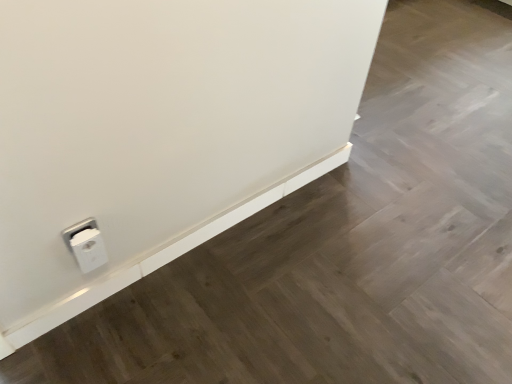
Measure the distance between point (88,256) and camera.

They are 3.60 feet apart.

Describe the element at coordinates (86, 244) in the screenshot. I see `white plastic power plug at lower left` at that location.

The height and width of the screenshot is (384, 512). What are the coordinates of `white plastic power plug at lower left` in the screenshot? It's located at (86, 244).

Measure the distance between point (275, 201) and camera.

The distance of point (275, 201) from camera is 1.59 meters.

What do you see at coordinates (164, 255) in the screenshot? The image size is (512, 384). I see `white plastic ledge at lower left` at bounding box center [164, 255].

Image resolution: width=512 pixels, height=384 pixels. What are the coordinates of `white plastic ledge at lower left` in the screenshot? It's located at (164, 255).

Identify the location of white plastic power plug at lower left. (86, 244).

In the image, is white plastic ledge at lower left on the left side or the right side of white plastic power plug at lower left?

Based on their positions, white plastic ledge at lower left is located to the right of white plastic power plug at lower left.

Does white plastic ledge at lower left lie in front of white plastic power plug at lower left?

No, it is behind white plastic power plug at lower left.

Does point (83, 301) appear closer or farther from the camera than point (76, 252)?

Point (83, 301) is positioned farther from the camera compared to point (76, 252).

From the image's perspective, relative to white plastic power plug at lower left, is white plastic ledge at lower left above or below?

Based on their image positions, white plastic ledge at lower left is located above white plastic power plug at lower left.

From a real-world perspective, is white plastic ledge at lower left below white plastic power plug at lower left?

Correct, in the physical world, white plastic ledge at lower left is lower than white plastic power plug at lower left.

Which of these two, white plastic ledge at lower left or white plastic power plug at lower left, is thinner?

white plastic ledge at lower left is thinner.

From their relative heights in the image, would you say white plastic ledge at lower left is taller or shorter than white plastic power plug at lower left?

In the image, white plastic ledge at lower left appears to be shorter than white plastic power plug at lower left.

Considering the relative sizes of white plastic ledge at lower left and white plastic power plug at lower left in the image provided, is white plastic ledge at lower left bigger than white plastic power plug at lower left?

Yes, white plastic ledge at lower left is bigger than white plastic power plug at lower left.

In the scene shown: Which is correct: white plastic ledge at lower left is inside white plastic power plug at lower left, or outside of it?

white plastic ledge at lower left is not enclosed by white plastic power plug at lower left.

Is white plastic ledge at lower left positioned far away from white plastic power plug at lower left?

No, there isn't a large distance between white plastic ledge at lower left and white plastic power plug at lower left.

Is white plastic ledge at lower left positioned with its back to white plastic power plug at lower left?

white plastic ledge at lower left is not turned away from white plastic power plug at lower left.

How many degrees apart are the facing directions of white plastic ledge at lower left and white plastic power plug at lower left?

0.499 degrees separate the facing orientations of white plastic ledge at lower left and white plastic power plug at lower left.

At what (x,y) coordinates should I click in order to perform the action: click on power plugs and sockets on the left of the white plastic ledge at lower left. Please return your answer as a coordinate pair (x, y). The height and width of the screenshot is (384, 512). Looking at the image, I should click on (86, 244).

Between white plastic power plug at lower left and white plastic ledge at lower left, which one appears on the right side from the viewer's perspective?

From the viewer's perspective, white plastic ledge at lower left appears more on the right side.

Does white plastic power plug at lower left lie behind white plastic ledge at lower left?

No.

Is point (68, 230) closer or farther from the camera than point (60, 320)?

Point (68, 230) is closer to the camera than point (60, 320).

From the image's perspective, is white plastic power plug at lower left above or below white plastic ledge at lower left?

Based on their image positions, white plastic power plug at lower left is located beneath white plastic ledge at lower left.

From a real-world perspective, does white plastic power plug at lower left stand above white plastic ledge at lower left?

Yes, from a real-world perspective, white plastic power plug at lower left is above white plastic ledge at lower left.

Looking at their sizes, would you say white plastic power plug at lower left is wider or thinner than white plastic ledge at lower left?

Considering their sizes, white plastic power plug at lower left looks broader than white plastic ledge at lower left.

In terms of height, does white plastic power plug at lower left look taller or shorter compared to white plastic ledge at lower left?

Clearly, white plastic power plug at lower left is taller compared to white plastic ledge at lower left.

Is white plastic power plug at lower left bigger than white plastic ledge at lower left?

Incorrect, white plastic power plug at lower left is not larger than white plastic ledge at lower left.

Could white plastic ledge at lower left be considered to be inside white plastic power plug at lower left?

No, white plastic ledge at lower left is not surrounded by white plastic power plug at lower left.

Would you say white plastic power plug at lower left is a long distance from white plastic ledge at lower left?

No, white plastic power plug at lower left is not far away from white plastic ledge at lower left.

Could you tell me if white plastic power plug at lower left is facing white plastic ledge at lower left?

No, white plastic power plug at lower left is not aimed at white plastic ledge at lower left.

Can you tell me how much white plastic power plug at lower left and white plastic ledge at lower left differ in facing direction?

The angular difference between white plastic power plug at lower left and white plastic ledge at lower left is 0.499 degrees.

This screenshot has width=512, height=384. What are the coordinates of `ledge lying behind the white plastic power plug at lower left` in the screenshot? It's located at (164, 255).

Where is `power plugs and sockets that appears on the left of white plastic ledge at lower left`? The image size is (512, 384). power plugs and sockets that appears on the left of white plastic ledge at lower left is located at coordinates (86, 244).

Where is `ledge located on the right of white plastic power plug at lower left`? The image size is (512, 384). ledge located on the right of white plastic power plug at lower left is located at coordinates 164,255.